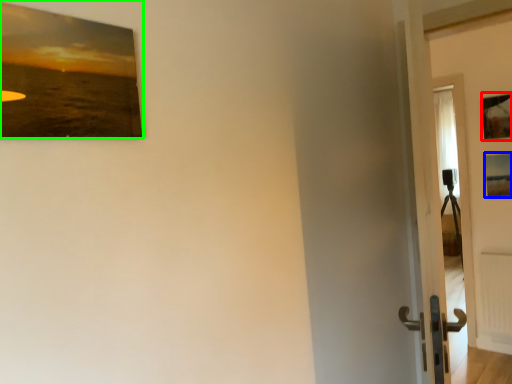
Question: Based on their relative distances, which object is farther from picture frame (highlighted by a red box)? Choose from picture frame (highlighted by a blue box) and picture frame (highlighted by a green box).

Choices:
 (A) picture frame
 (B) picture frame

Answer: (B)